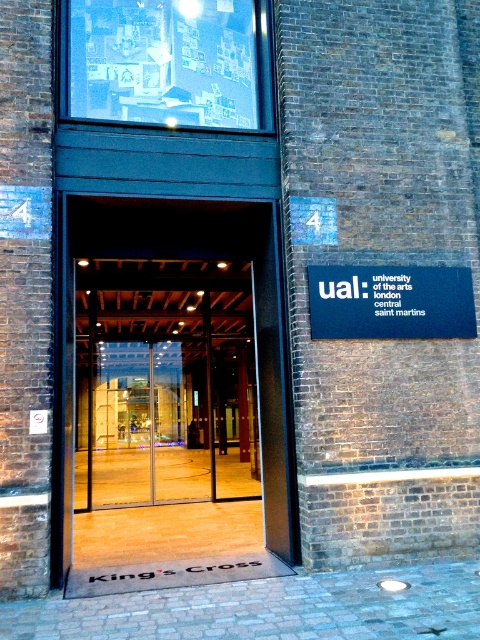
You are standing at the entrance of the UAL campus and want to locate the transparent glass door at center. According to the coordinates provided, where exactly is it positioned?

The transparent glass door at center is located at point coordinates of (178, 381).